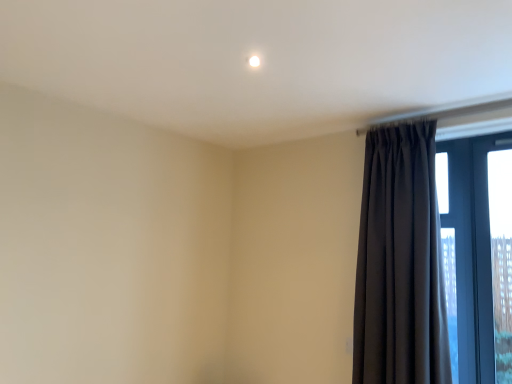
Question: Relative to clear glass window at right, is dark matte curtain at right in front or behind?

Choices:
 (A) front
 (B) behind

Answer: (A)

Question: Considering the positions of dark matte curtain at right and clear glass window at right in the image, is dark matte curtain at right wider or thinner than clear glass window at right?

Choices:
 (A) thin
 (B) wide

Answer: (B)

Question: Considering the positions of dark matte curtain at right and clear glass window at right in the image, is dark matte curtain at right taller or shorter than clear glass window at right?

Choices:
 (A) tall
 (B) short

Answer: (A)

Question: Looking at the image, does clear glass window at right seem bigger or smaller compared to dark matte curtain at right?

Choices:
 (A) big
 (B) small

Answer: (B)

Question: In terms of height, does clear glass window at right look taller or shorter compared to dark matte curtain at right?

Choices:
 (A) tall
 (B) short

Answer: (B)

Question: Does point (474, 238) appear closer or farther from the camera than point (365, 294)?

Choices:
 (A) closer
 (B) farther

Answer: (B)

Question: From the image's perspective, is clear glass window at right above or below dark matte curtain at right?

Choices:
 (A) above
 (B) below

Answer: (B)